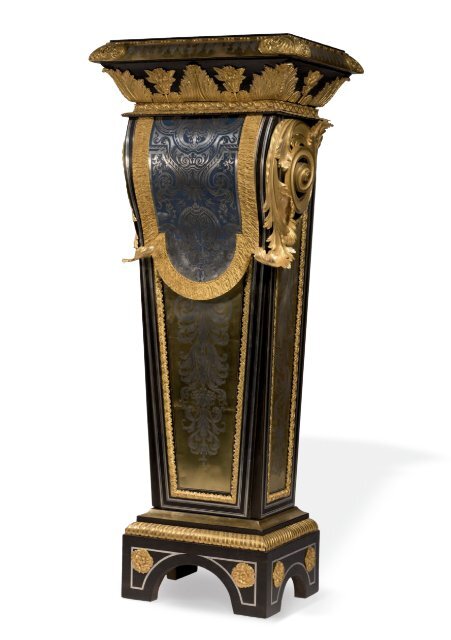
In order to click on right top front cornter of artwork in this screenshot , I will do `click(290, 45)`.